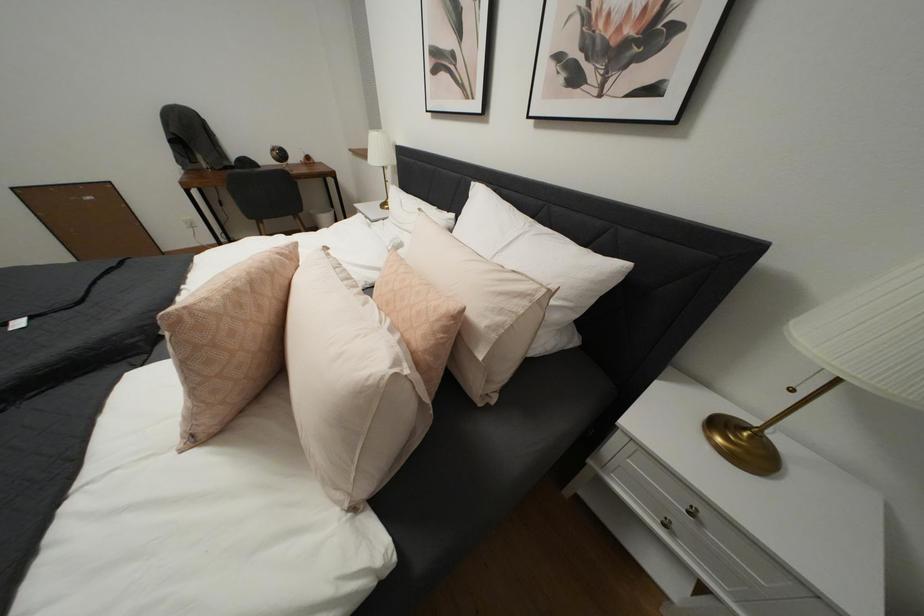
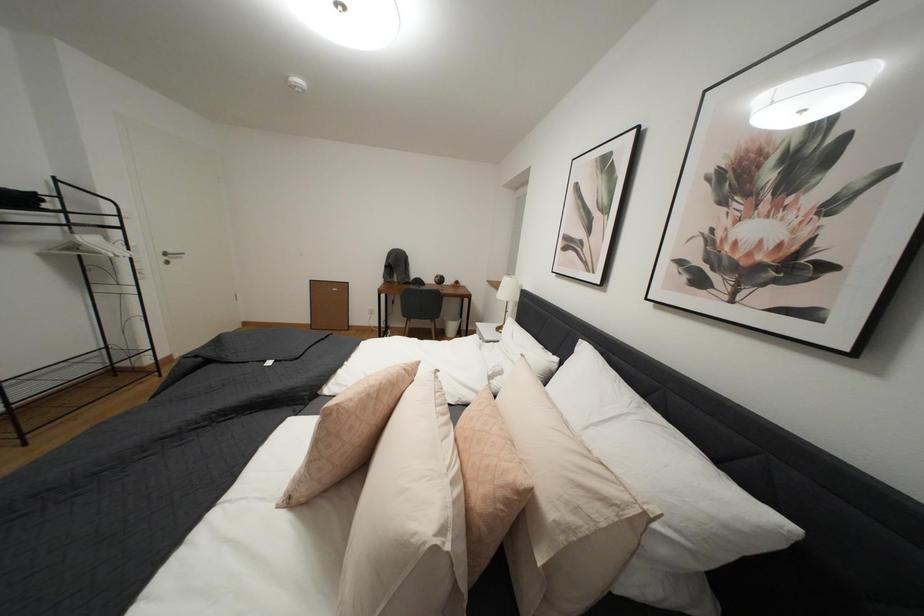
Based on the continuous images, in which direction is the camera rotating?

The rotation direction of the camera is left-up.